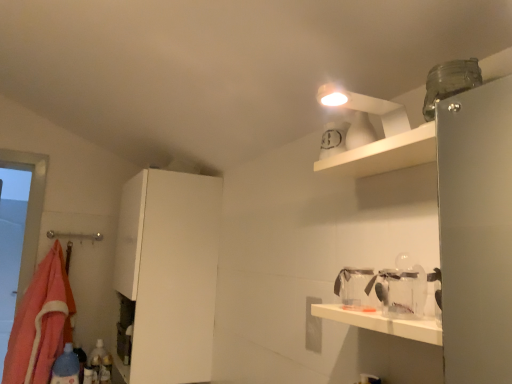
What do you see at coordinates (41, 323) in the screenshot?
I see `orange fleece blanket at left` at bounding box center [41, 323].

What is the approximate width of white matte cabinet at left?

15.29 inches.

The image size is (512, 384). What do you see at coordinates (169, 272) in the screenshot?
I see `white matte cabinet at left` at bounding box center [169, 272].

What is the approximate height of transparent plastic jar at lower right?

The height of transparent plastic jar at lower right is 4.62 inches.

This screenshot has height=384, width=512. I want to click on blue plastic bottle at lower left, so click(x=66, y=367).

Is white matte cabinet at left at the back of blue plastic bottle at lower left?

No, blue plastic bottle at lower left's orientation is not away from white matte cabinet at left.

Would you say blue plastic bottle at lower left is to the left or to the right of white matte cabinet at left in the picture?

Clearly, blue plastic bottle at lower left is on the left of white matte cabinet at left in the image.

Is blue plastic bottle at lower left outside of white matte cabinet at left?

Absolutely, blue plastic bottle at lower left is external to white matte cabinet at left.

Is blue plastic bottle at lower left wider than white matte cabinet at left?

Incorrect, the width of blue plastic bottle at lower left does not surpass that of white matte cabinet at left.

Could you tell me if white matte cabinet at left is facing transparent plastic jar at lower right?

No, white matte cabinet at left is not oriented towards transparent plastic jar at lower right.

From a real-world perspective, which is physically below, white matte cabinet at left or transparent plastic jar at lower right?

From a 3D spatial view, white matte cabinet at left is below.

Who is smaller, white matte cabinet at left or transparent plastic jar at lower right?

transparent plastic jar at lower right.

Consider the image. Which is more to the left, white matte cabinet at left or transparent plastic jar at lower right?

white matte cabinet at left is more to the left.

Does transparent plastic jar at lower right contain blue plastic bottle at lower left?

No, transparent plastic jar at lower right does not contain blue plastic bottle at lower left.

Based on the photo, is transparent plastic jar at lower right facing away from blue plastic bottle at lower left?

transparent plastic jar at lower right does not have its back to blue plastic bottle at lower left.

From the image's perspective, would you say transparent plastic jar at lower right is positioned over blue plastic bottle at lower left?

Correct, transparent plastic jar at lower right appears higher than blue plastic bottle at lower left in the image.

The width and height of the screenshot is (512, 384). Find the location of `bottle lying on the right of orange fleece blanket at left`. bottle lying on the right of orange fleece blanket at left is located at coordinates [66, 367].

From the image's perspective, which is above, blue plastic bottle at lower left or orange fleece blanket at left?

orange fleece blanket at left appears higher in the image.

Is point (75, 381) positioned after point (63, 283)?

No, it is not.

Which object is positioned more to the left, blue plastic bottle at lower left or orange fleece blanket at left?

orange fleece blanket at left is more to the left.

Is transparent plastic jar at lower right smaller than orange fleece blanket at left?

Yes, transparent plastic jar at lower right is smaller than orange fleece blanket at left.

You are a GUI agent. You are given a task and a screenshot of the screen. Output one action in this format:
    pyautogui.click(x=<x>, y=<y>)
    Task: Click on the blanket located on the left of transparent plastic jar at lower right
    The width and height of the screenshot is (512, 384).
    Given the screenshot: What is the action you would take?
    pyautogui.click(x=41, y=323)

Would you say transparent plastic jar at lower right contains orange fleece blanket at left?

No, orange fleece blanket at left is located outside of transparent plastic jar at lower right.

Is the depth of transparent plastic jar at lower right less than that of orange fleece blanket at left?

Yes.

Considering the relative sizes of orange fleece blanket at left and transparent plastic jar at lower right in the image provided, is orange fleece blanket at left shorter than transparent plastic jar at lower right?

In fact, orange fleece blanket at left may be taller than transparent plastic jar at lower right.

Does orange fleece blanket at left turn towards transparent plastic jar at lower right?

No, orange fleece blanket at left is not aimed at transparent plastic jar at lower right.

What are the coordinates of `glass jar located above the orange fleece blanket at left (from the image's perspective)` in the screenshot? It's located at (402, 289).

From the image's perspective, is orange fleece blanket at left on transparent plastic jar at lower right?

Actually, orange fleece blanket at left appears below transparent plastic jar at lower right in the image.

Is orange fleece blanket at left turned away from white matte cabinet at left?

orange fleece blanket at left does not have its back to white matte cabinet at left.

Are orange fleece blanket at left and white matte cabinet at left making contact?

orange fleece blanket at left and white matte cabinet at left are not in contact.

From the image's perspective, is orange fleece blanket at left positioned above or below white matte cabinet at left?

Based on their image positions, orange fleece blanket at left is located beneath white matte cabinet at left.

In the scene shown: Can you confirm if orange fleece blanket at left is wider than white matte cabinet at left?

No.

In order to click on bottle that is on the left side of white matte cabinet at left in this screenshot , I will do `click(66, 367)`.

This screenshot has height=384, width=512. I want to click on cabinetry behind the transparent plastic jar at lower right, so click(169, 272).

Which object lies further to the anchor point blue plastic bottle at lower left, orange fleece blanket at left or transparent plastic jar at lower right?

transparent plastic jar at lower right lies further to blue plastic bottle at lower left than the other object.

From the image, which object appears to be nearer to transparent plastic jar at lower right, blue plastic bottle at lower left or orange fleece blanket at left?

Based on the image, blue plastic bottle at lower left appears to be nearer to transparent plastic jar at lower right.

From the image, which object appears to be farther from white matte cabinet at left, transparent plastic jar at lower right or orange fleece blanket at left?

transparent plastic jar at lower right is positioned further to the anchor white matte cabinet at left.

In the scene shown: Looking at the image, which one is located further to blue plastic bottle at lower left, transparent plastic jar at lower right or orange fleece blanket at left?

Among the two, transparent plastic jar at lower right is located further to blue plastic bottle at lower left.

In the scene shown: Looking at the image, which one is located further to orange fleece blanket at left, transparent plastic jar at lower right or blue plastic bottle at lower left?

Based on the image, transparent plastic jar at lower right appears to be further to orange fleece blanket at left.

Considering their positions, is white matte cabinet at left positioned closer to transparent plastic jar at lower right than blue plastic bottle at lower left?

white matte cabinet at left is positioned closer to the anchor transparent plastic jar at lower right.

From the picture: Which object lies further to the anchor point blue plastic bottle at lower left, white matte cabinet at left or orange fleece blanket at left?

Among the two, white matte cabinet at left is located further to blue plastic bottle at lower left.

Estimate the real-world distances between objects in this image. Which object is closer to orange fleece blanket at left, white matte cabinet at left or blue plastic bottle at lower left?

blue plastic bottle at lower left is positioned closer to the anchor orange fleece blanket at left.

This screenshot has height=384, width=512. What are the coordinates of `cabinetry situated between orange fleece blanket at left and transparent plastic jar at lower right from left to right` in the screenshot? It's located at (169, 272).

At what (x,y) coordinates should I click in order to perform the action: click on bottle situated between orange fleece blanket at left and transparent plastic jar at lower right from left to right. Please return your answer as a coordinate pair (x, y). This screenshot has height=384, width=512. Looking at the image, I should click on (66, 367).

Where is `bottle between orange fleece blanket at left and white matte cabinet at left in the horizontal direction`? bottle between orange fleece blanket at left and white matte cabinet at left in the horizontal direction is located at coordinates (66, 367).

Find the location of a particular element. cabinetry between transparent plastic jar at lower right and blue plastic bottle at lower left along the z-axis is located at coordinates tap(169, 272).